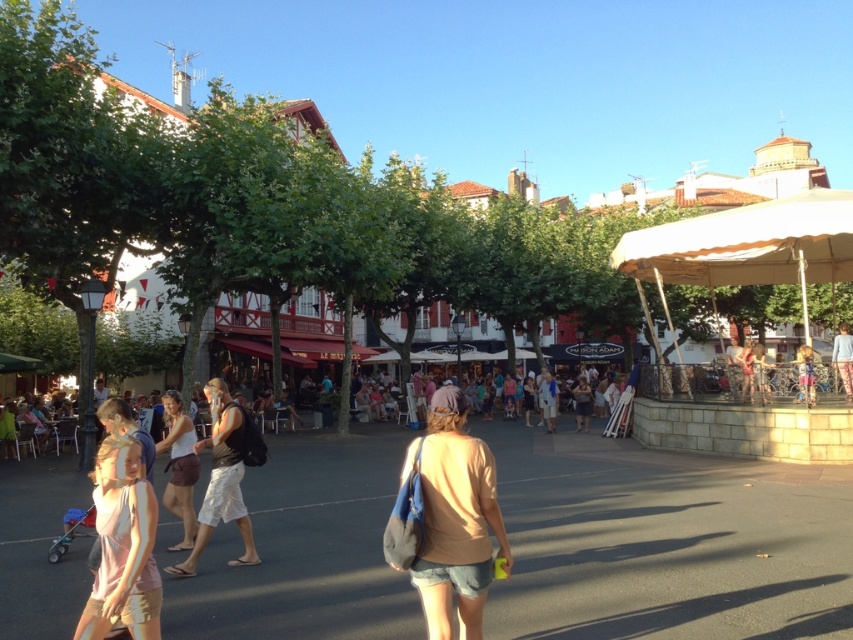
Can you confirm if beige fabric canopy at right is bigger than denim shorts at center?

Indeed, beige fabric canopy at right has a larger size compared to denim shorts at center.

Which is behind, point (679, 360) or point (456, 547)?

Point (679, 360)

Between point (824, 234) and point (432, 474), which one is positioned behind?

Point (824, 234)

The image size is (853, 640). In order to click on beige fabric canopy at right in this screenshot , I will do `click(747, 244)`.

Can you confirm if beige fabric canopy at right is wider than blue denim shorts at lower right?

Correct, the width of beige fabric canopy at right exceeds that of blue denim shorts at lower right.

Who is lower down, beige fabric canopy at right or blue denim shorts at lower right?

Positioned lower is blue denim shorts at lower right.

This screenshot has height=640, width=853. I want to click on beige fabric canopy at right, so click(x=747, y=244).

Can you confirm if beige fabric canopy at right is positioned above white matte shorts at center?

Correct, beige fabric canopy at right is located above white matte shorts at center.

Who is more distant from viewer, (x=782, y=262) or (x=190, y=420)?

Positioned behind is point (x=782, y=262).

Where is `beige fabric canopy at right`? The image size is (853, 640). beige fabric canopy at right is located at coordinates (747, 244).